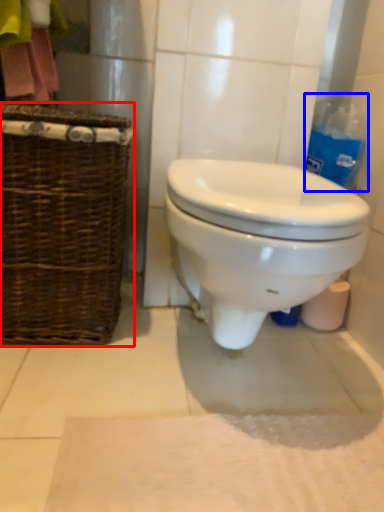
Question: Among these objects, which one is farthest to the camera, picnic basket (highlighted by a red box) or cleaning product (highlighted by a blue box)?

Choices:
 (A) picnic basket
 (B) cleaning product

Answer: (B)